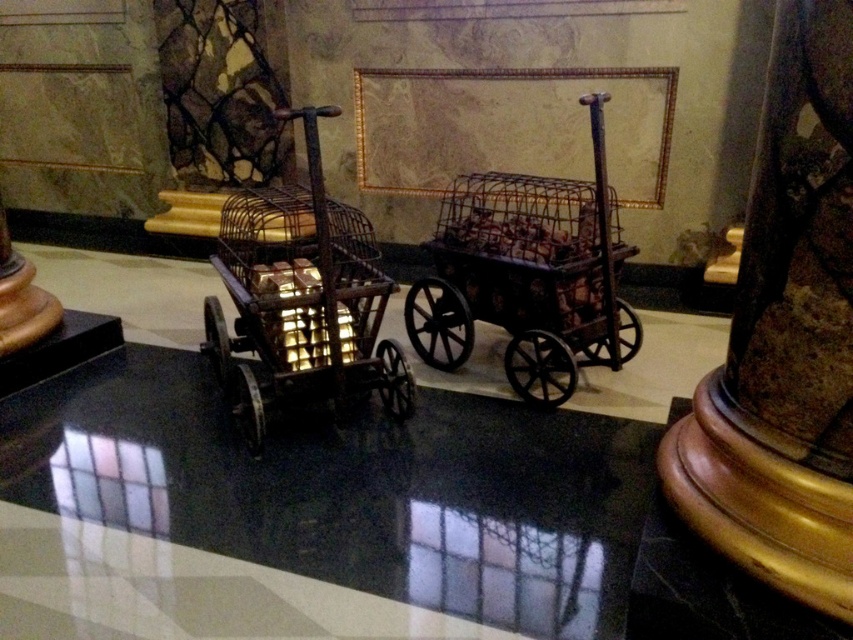
Question: Is rusty metal trolley at center positioned at the back of rusty metal cart at center?

Choices:
 (A) yes
 (B) no

Answer: (B)

Question: Which point is farther to the camera?

Choices:
 (A) (233, 288)
 (B) (451, 268)

Answer: (B)

Question: From the image, what is the correct spatial relationship of rusty metal trolley at center in relation to rusty metal cart at center?

Choices:
 (A) above
 (B) below

Answer: (A)

Question: Among these objects, which one is nearest to the camera?

Choices:
 (A) rusty metal cart at center
 (B) rusty metal trolley at center

Answer: (B)

Question: Considering the relative positions of rusty metal trolley at center and rusty metal cart at center in the image provided, where is rusty metal trolley at center located with respect to rusty metal cart at center?

Choices:
 (A) above
 (B) below

Answer: (A)